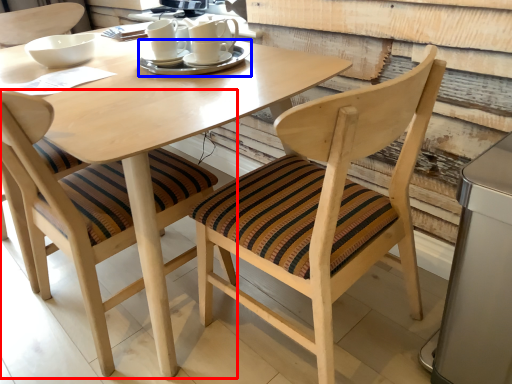
Question: Which of the following is the farthest to the observer, chair (highlighted by a red box) or tableware (highlighted by a blue box)?

Choices:
 (A) chair
 (B) tableware

Answer: (B)